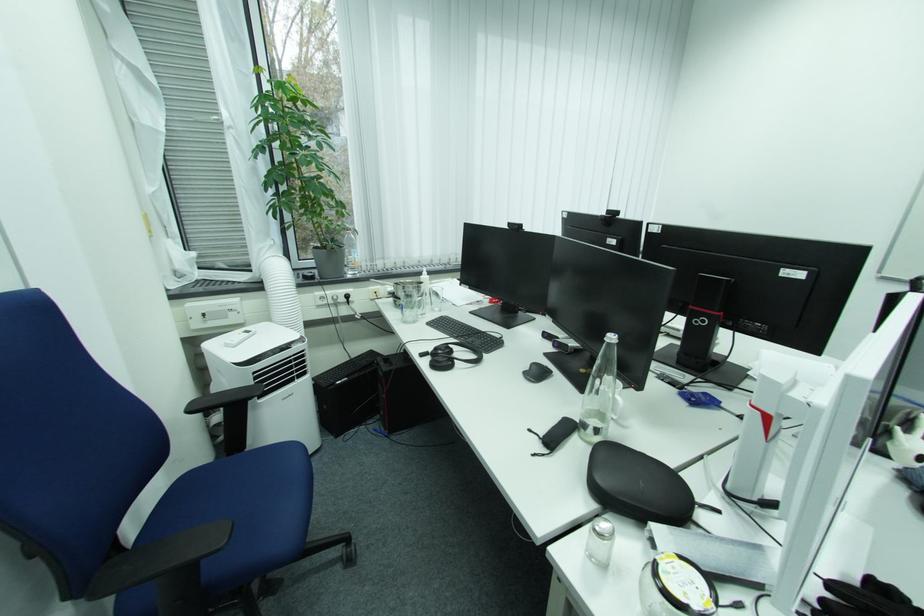
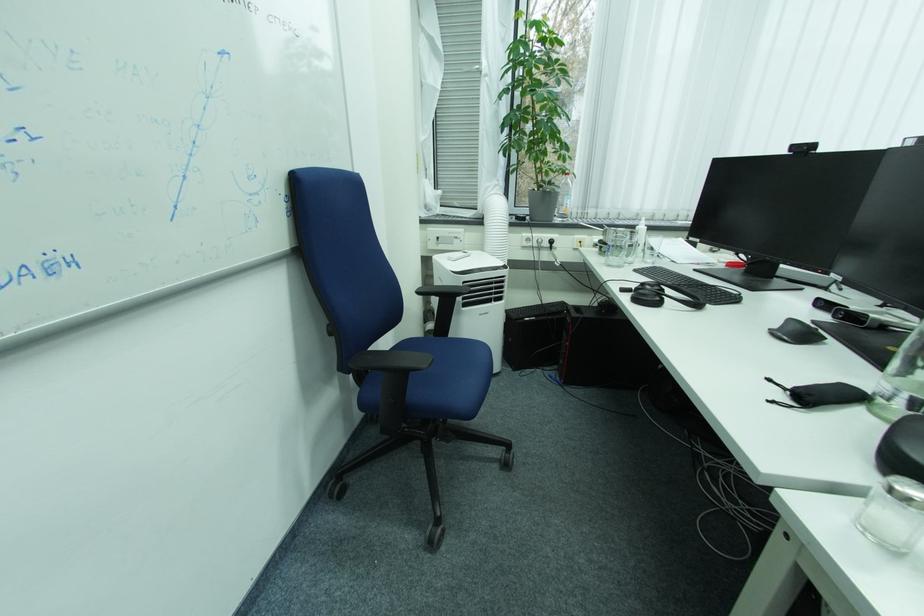
Locate, in the second image, the point that corresponds to [253,450] in the first image.

(455, 338)